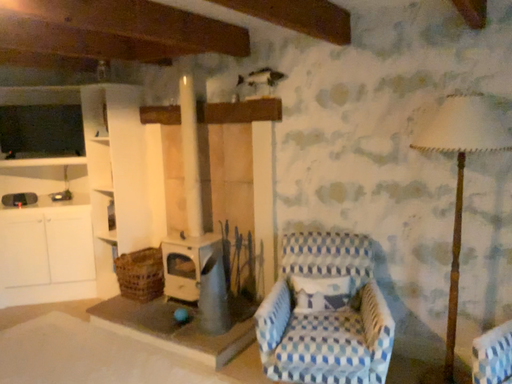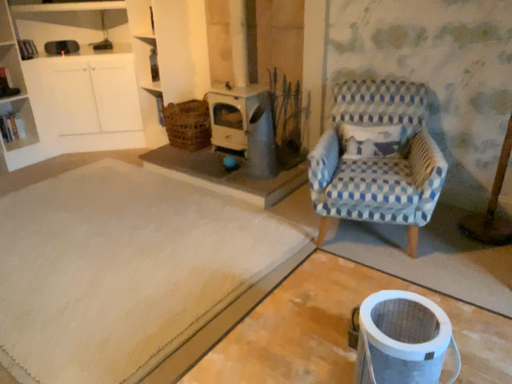
Question: Which way did the camera rotate in the video?

Choices:
 (A) rotated upward
 (B) rotated downward

Answer: (B)